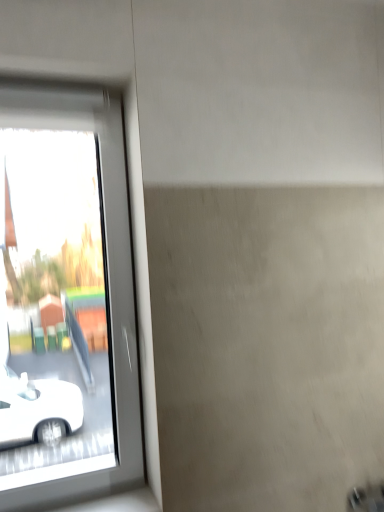
Describe the element at coordinates (65, 298) in the screenshot. I see `transparent glass window at left` at that location.

Where is `transparent glass window at left`? transparent glass window at left is located at coordinates (65, 298).

The height and width of the screenshot is (512, 384). In order to click on transparent glass window at left in this screenshot , I will do `click(65, 298)`.